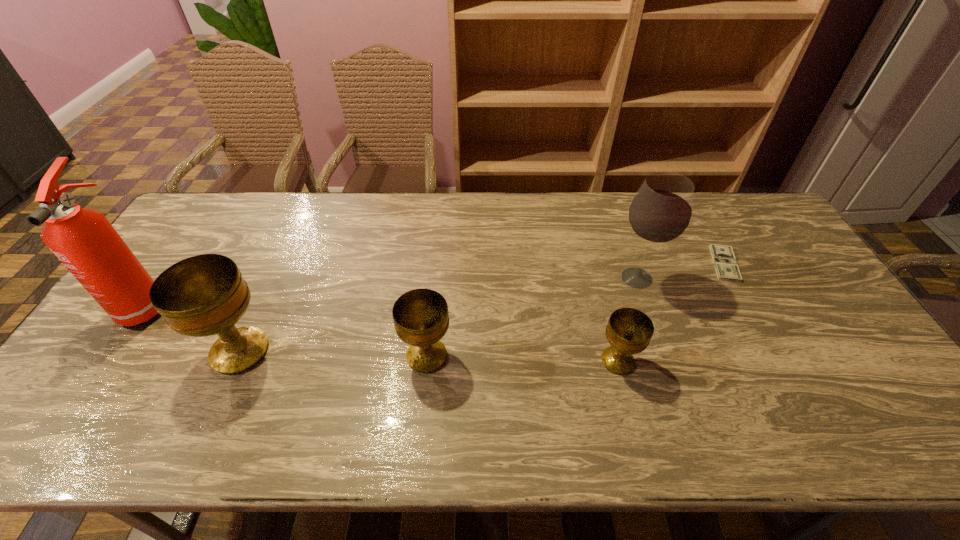
At what (x,y) coordinates should I click in order to perform the action: click on vacant region at the left edge of the desktop. Please return your answer as a coordinate pair (x, y). Looking at the image, I should click on (110, 327).

This screenshot has height=540, width=960. I want to click on free space at the right edge, so click(x=754, y=239).

The image size is (960, 540). Identify the location of free space at the far left corner. pyautogui.click(x=211, y=192).

Identify the location of vacant space at the far right corner. This screenshot has height=540, width=960. (750, 194).

This screenshot has width=960, height=540. In order to click on free space at the near right corner of the desktop in this screenshot , I will do `click(822, 377)`.

Identify the location of free spot between the fourth tallest object and the shortest chalice. (522, 358).

You are a GUI agent. You are given a task and a screenshot of the screen. Output one action in this format:
    pyautogui.click(x=<x>, y=<y>)
    Task: Click on the blank region between the second shortest chalice and the leftmost chalice
    
    Given the screenshot: What is the action you would take?
    pyautogui.click(x=333, y=353)

Locate an element on the screen. This screenshot has height=540, width=960. free spot between the fire extinguisher and the second tallest chalice is located at coordinates (287, 330).

Where is `free space that is in between the fourth object from right to left and the leftmost object`? free space that is in between the fourth object from right to left and the leftmost object is located at coordinates (287, 330).

At what (x,y) coordinates should I click in order to perform the action: click on free space between the second chalice from left to right and the alcohol. Please return your answer as a coordinate pair (x, y). Looking at the image, I should click on (532, 317).